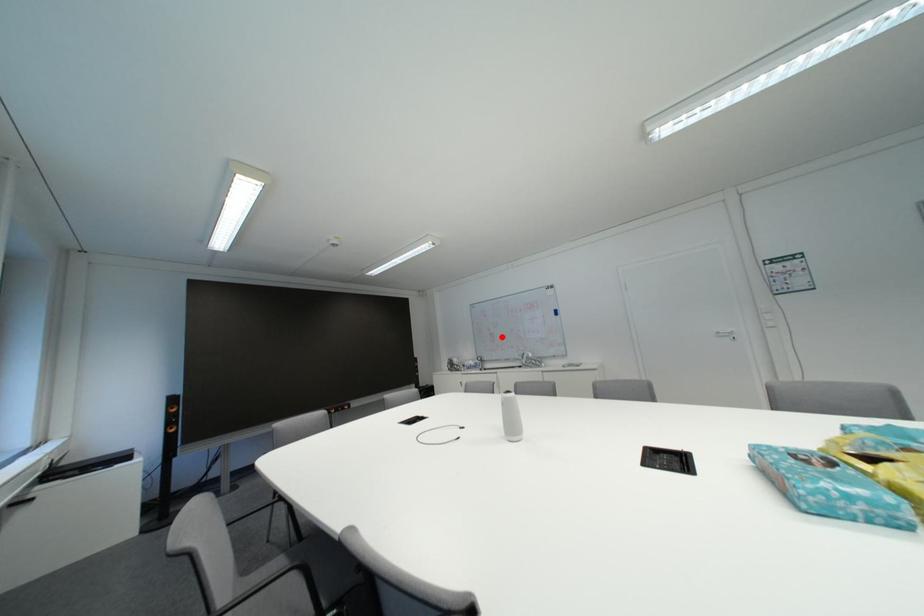
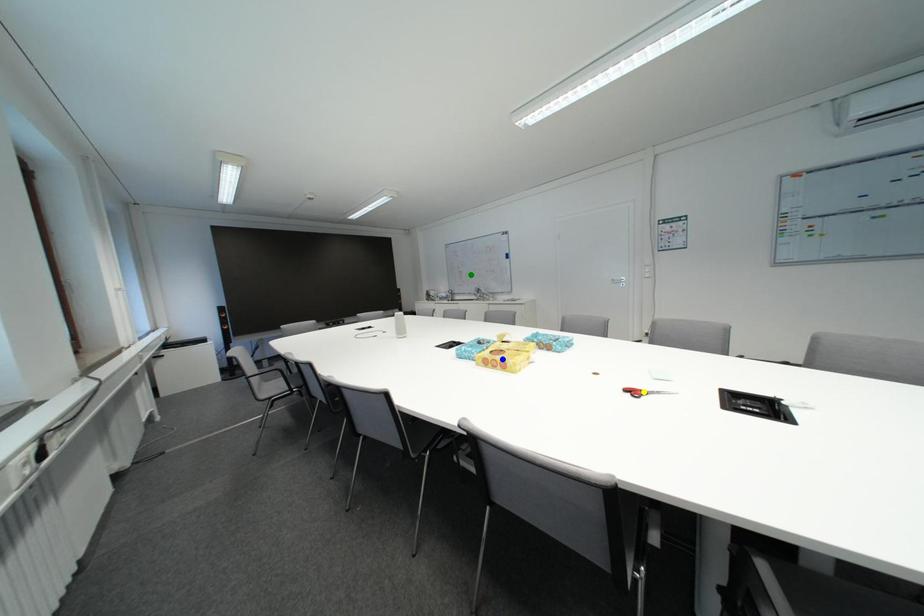
Question: I am providing you with two images of the same scene from different viewpoints. A red point is marked on the first image. You are given multiple points on the second image. Which spot in image 2 lines up with the point in image 1?

Choices:
 (A) yellow point
 (B) green point
 (C) blue point

Answer: (B)